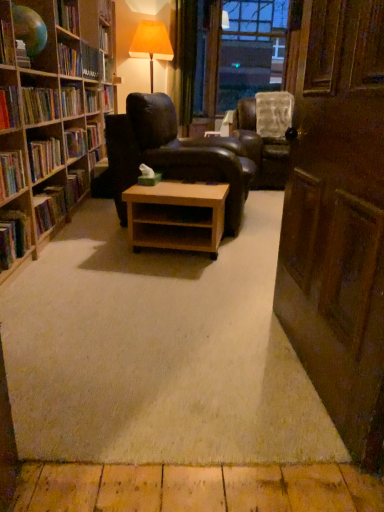
Locate an element on the screen. This screenshot has width=384, height=512. vacant area that is in front of light brown wood at center is located at coordinates (167, 275).